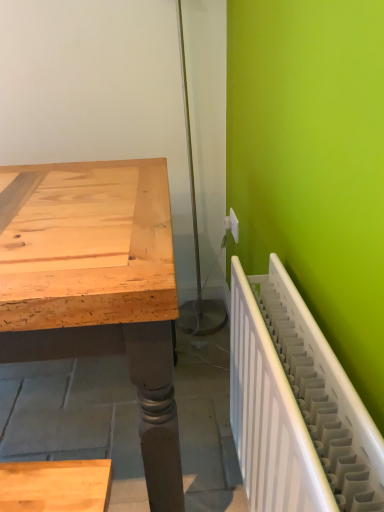
Question: Do you think white plastic electric outlet at upper right is within white plastic radiator at lower right, or outside of it?

Choices:
 (A) inside
 (B) outside

Answer: (B)

Question: Considering the positions of white plastic electric outlet at upper right and white plastic radiator at lower right in the image, is white plastic electric outlet at upper right bigger or smaller than white plastic radiator at lower right?

Choices:
 (A) small
 (B) big

Answer: (A)

Question: From the image's perspective, relative to white plastic radiator at lower right, is white plastic electric outlet at upper right above or below?

Choices:
 (A) below
 (B) above

Answer: (B)

Question: In the image, is white plastic radiator at lower right on the left side or the right side of white plastic electric outlet at upper right?

Choices:
 (A) left
 (B) right

Answer: (B)

Question: Considering the positions of white plastic radiator at lower right and white plastic electric outlet at upper right in the image, is white plastic radiator at lower right wider or thinner than white plastic electric outlet at upper right?

Choices:
 (A) thin
 (B) wide

Answer: (B)

Question: Based on their sizes in the image, would you say white plastic radiator at lower right is bigger or smaller than white plastic electric outlet at upper right?

Choices:
 (A) big
 (B) small

Answer: (A)

Question: Which is correct: white plastic radiator at lower right is inside white plastic electric outlet at upper right, or outside of it?

Choices:
 (A) inside
 (B) outside

Answer: (B)